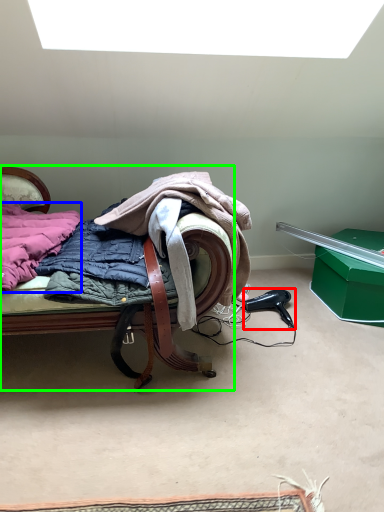
Question: Which object is positioned farthest from hair drier (highlighted by a red box)? Select from underclothes (highlighted by a blue box) and furniture (highlighted by a green box).

Choices:
 (A) underclothes
 (B) furniture

Answer: (A)